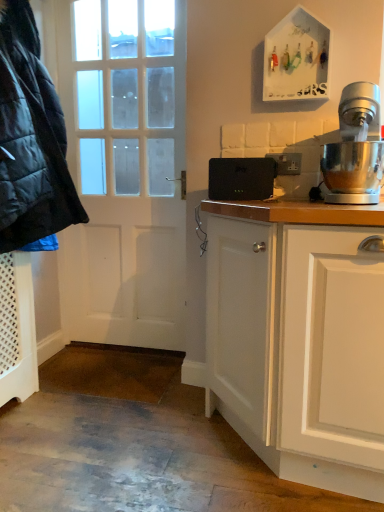
This screenshot has height=512, width=384. Identify the location of white matte door at left. (124, 169).

This screenshot has height=512, width=384. What do you see at coordinates (355, 149) in the screenshot?
I see `polished stainless steel stand mixer at right` at bounding box center [355, 149].

The width and height of the screenshot is (384, 512). Identify the location of polished stainless steel stand mixer at right. (355, 149).

The width and height of the screenshot is (384, 512). What do you see at coordinates (241, 178) in the screenshot? I see `black plastic router at center` at bounding box center [241, 178].

Where is `white matte door at left`? white matte door at left is located at coordinates (124, 169).

How many degrees apart are the facing directions of matte black jacket at left and black plastic router at center?

83.4 degrees.

Considering the relative sizes of matte black jacket at left and black plastic router at center in the image provided, is matte black jacket at left shorter than black plastic router at center?

No.

Considering the positions of objects matte black jacket at left and black plastic router at center in the image provided, who is behind, matte black jacket at left or black plastic router at center?

black plastic router at center is further from the camera.

Looking at this image, considering the relative positions of matte black jacket at left and black plastic router at center in the image provided, is matte black jacket at left to the right of black plastic router at center from the viewer's perspective?

Incorrect, matte black jacket at left is not on the right side of black plastic router at center.

Is the position of white matte door at left more distant than that of polished stainless steel stand mixer at right?

Yes, white matte door at left is further from the viewer.

From the image's perspective, is white matte door at left on polished stainless steel stand mixer at right?

Correct, white matte door at left appears higher than polished stainless steel stand mixer at right in the image.

Is white matte door at left aimed at polished stainless steel stand mixer at right?

No.

Based on the photo, considering the positions of objects polished stainless steel stand mixer at right and matte black jacket at left in the image provided, who is more to the right, polished stainless steel stand mixer at right or matte black jacket at left?

polished stainless steel stand mixer at right.

Is polished stainless steel stand mixer at right next to matte black jacket at left?

No, polished stainless steel stand mixer at right is not making contact with matte black jacket at left.

Between polished stainless steel stand mixer at right and matte black jacket at left, which one has smaller size?

polished stainless steel stand mixer at right.

Consider the image. Measure the distance between polished stainless steel stand mixer at right and matte black jacket at left.

polished stainless steel stand mixer at right and matte black jacket at left are 1.11 meters apart.

Is matte black jacket at left wider than polished stainless steel stand mixer at right?

Yes, matte black jacket at left is wider than polished stainless steel stand mixer at right.

Is point (73, 196) closer to viewer compared to point (321, 168)?

No, it is behind (321, 168).

Can you confirm if matte black jacket at left is taller than polished stainless steel stand mixer at right?

Indeed, matte black jacket at left has a greater height compared to polished stainless steel stand mixer at right.

How far apart are matte black jacket at left and polished stainless steel stand mixer at right?

matte black jacket at left is 1.11 meters away from polished stainless steel stand mixer at right.

Is black plastic router at center in front of or behind polished stainless steel stand mixer at right in the image?

In the image, black plastic router at center appears behind polished stainless steel stand mixer at right.

Is black plastic router at center with polished stainless steel stand mixer at right?

No.

Is black plastic router at center located outside polished stainless steel stand mixer at right?

black plastic router at center is positioned outside polished stainless steel stand mixer at right.

Can you confirm if black plastic router at center is wider than polished stainless steel stand mixer at right?

No, black plastic router at center is not wider than polished stainless steel stand mixer at right.

Considering the sizes of white matte door at left and black plastic router at center in the image, is white matte door at left wider or thinner than black plastic router at center?

Considering their sizes, white matte door at left looks broader than black plastic router at center.

Is white matte door at left oriented away from black plastic router at center?

white matte door at left is not turned away from black plastic router at center.

How far apart are white matte door at left and black plastic router at center?

white matte door at left and black plastic router at center are 29.52 inches apart from each other.

Is white matte door at left to the right of black plastic router at center from the viewer's perspective?

In fact, white matte door at left is to the left of black plastic router at center.

Does black plastic router at center touch matte black jacket at left?

No, black plastic router at center is not in contact with matte black jacket at left.

Can matte black jacket at left be found inside black plastic router at center?

Actually, matte black jacket at left is outside black plastic router at center.

The image size is (384, 512). I want to click on appliance behind the matte black jacket at left, so click(x=241, y=178).

Is black plastic router at center to the left or to the right of matte black jacket at left in the image?

Clearly, black plastic router at center is on the right of matte black jacket at left in the image.

This screenshot has width=384, height=512. Find the location of `jacket in front of the black plastic router at center`. jacket in front of the black plastic router at center is located at coordinates (31, 138).

You are a GUI agent. You are given a task and a screenshot of the screen. Output one action in this format:
    pyautogui.click(x=<x>, y=<y>)
    Task: Click on the door behind the polished stainless steel stand mixer at right
    This screenshot has width=384, height=512.
    Given the screenshot: What is the action you would take?
    pyautogui.click(x=124, y=169)

Which object lies nearer to the anchor point polished stainless steel stand mixer at right, white matte door at left or black plastic router at center?

black plastic router at center is positioned closer to the anchor polished stainless steel stand mixer at right.

From the image, which object appears to be farther from white matte door at left, matte black jacket at left or polished stainless steel stand mixer at right?

polished stainless steel stand mixer at right is further to white matte door at left.

When comparing their distances from matte black jacket at left, does polished stainless steel stand mixer at right or white matte door at left seem further?

polished stainless steel stand mixer at right is positioned further to the anchor matte black jacket at left.

Estimate the real-world distances between objects in this image. Which object is closer to polished stainless steel stand mixer at right, matte black jacket at left or white matte door at left?

white matte door at left.

From the image, which object appears to be farther from black plastic router at center, matte black jacket at left or white matte door at left?

Among the two, white matte door at left is located further to black plastic router at center.

Based on their spatial positions, is matte black jacket at left or polished stainless steel stand mixer at right further from black plastic router at center?

matte black jacket at left is further to black plastic router at center.

Which object lies nearer to the anchor point matte black jacket at left, polished stainless steel stand mixer at right or black plastic router at center?

black plastic router at center is closer to matte black jacket at left.

Consider the image. When comparing their distances from white matte door at left, does black plastic router at center or matte black jacket at left seem further?

Among the two, black plastic router at center is located further to white matte door at left.

This screenshot has width=384, height=512. Find the location of `door located between matte black jacket at left and polished stainless steel stand mixer at right in the left-right direction`. door located between matte black jacket at left and polished stainless steel stand mixer at right in the left-right direction is located at coordinates (124, 169).

Locate an element on the screen. This screenshot has height=512, width=384. appliance positioned between matte black jacket at left and white matte door at left from near to far is located at coordinates (241, 178).

I want to click on appliance between white matte door at left and polished stainless steel stand mixer at right from left to right, so click(x=241, y=178).

Where is `appliance between matte black jacket at left and polished stainless steel stand mixer at right in the horizontal direction`? The height and width of the screenshot is (512, 384). appliance between matte black jacket at left and polished stainless steel stand mixer at right in the horizontal direction is located at coordinates (241, 178).